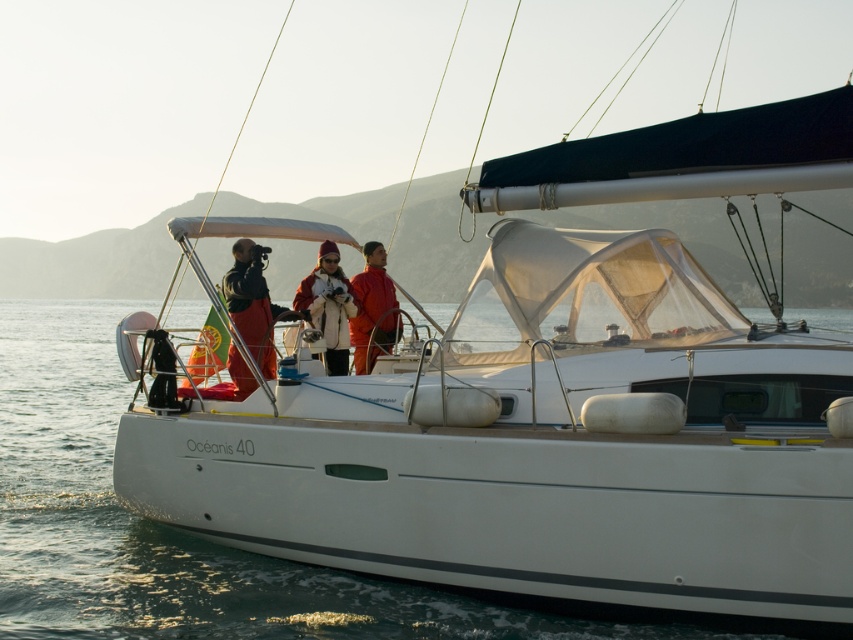
Question: Based on their relative distances, which object is farther from the dark brown leather jacket at center?

Choices:
 (A) matte red coat at center
 (B) matte orange jacket at center
 (C) clear water at center

Answer: (C)

Question: Can you confirm if matte red coat at center is positioned to the right of matte orange jacket at center?

Choices:
 (A) no
 (B) yes

Answer: (A)

Question: Where is dark brown leather jacket at center located in relation to matte orange jacket at center in the image?

Choices:
 (A) left
 (B) right

Answer: (A)

Question: Does clear water at center have a lesser width compared to matte red coat at center?

Choices:
 (A) no
 (B) yes

Answer: (A)

Question: Which of the following is the farthest from the observer?

Choices:
 (A) dark brown leather jacket at center
 (B) matte red coat at center
 (C) clear water at center

Answer: (B)

Question: Estimate the real-world distances between objects in this image. Which object is closer to the dark brown leather jacket at center?

Choices:
 (A) matte red coat at center
 (B) matte orange jacket at center
 (C) clear water at center

Answer: (A)